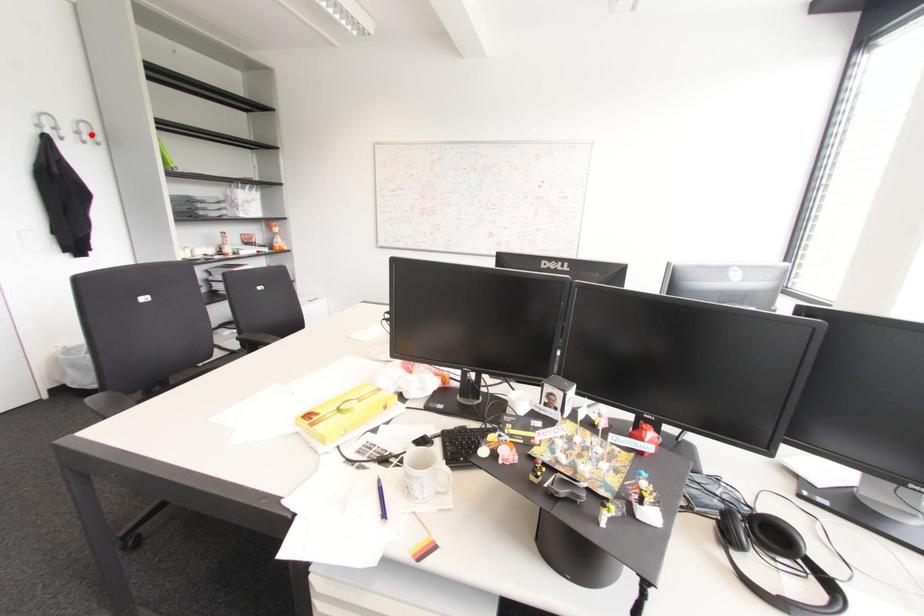
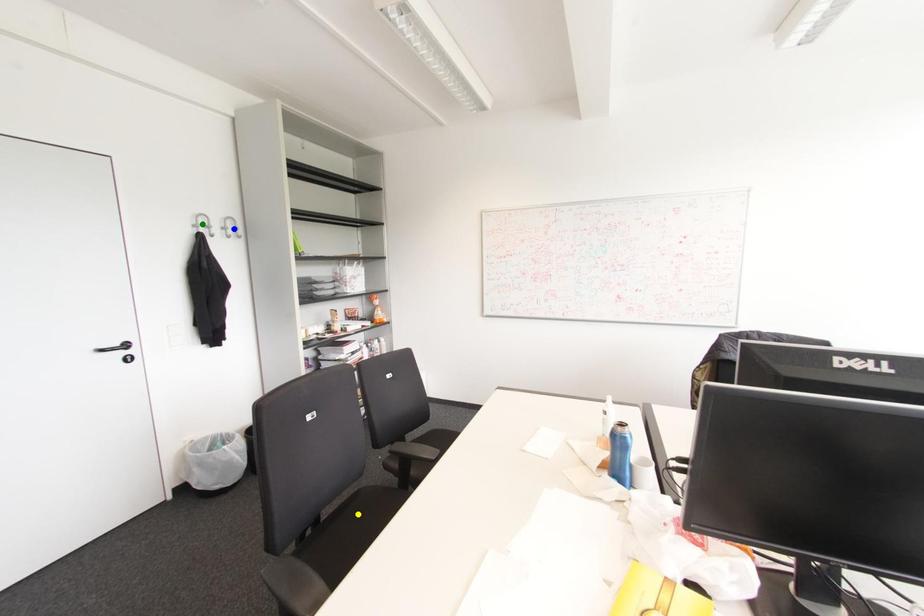
Question: I am providing you with two images of the same scene from different viewpoints. A red point is marked on the first image. You are given multiple points on the second image. Can you choose the point in image 2 that corresponds to the point in image 1?

Choices:
 (A) yellow point
 (B) blue point
 (C) green point

Answer: (B)